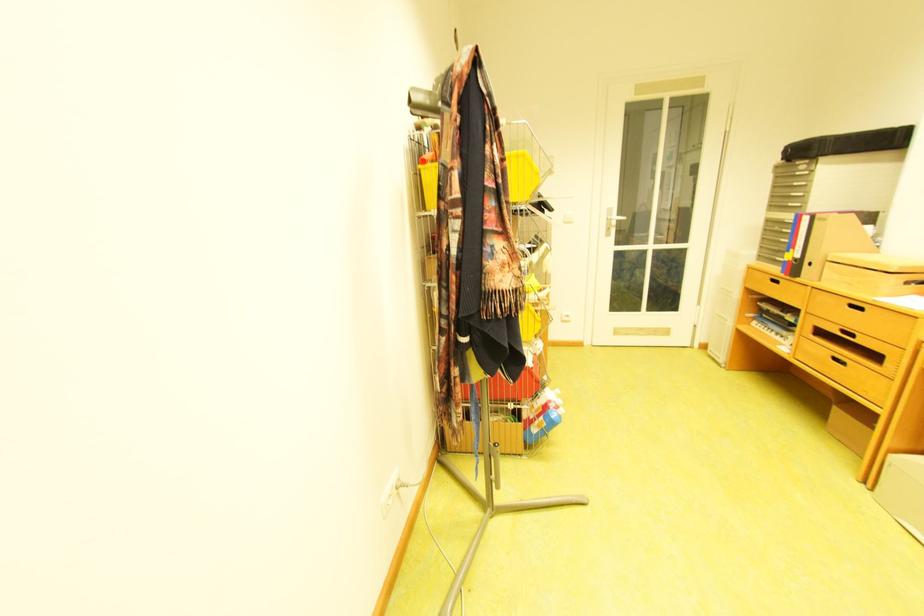
At what (x,y) coordinates should I click in order to perform the action: click on white power outlet. Please return your answer as a coordinate pair (x, y). This screenshot has width=924, height=616. Looking at the image, I should click on (405, 485).